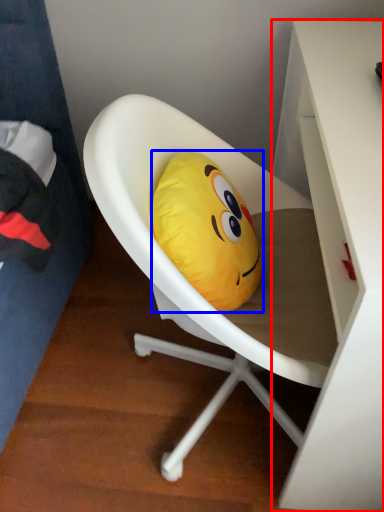
Question: Which point is closer to the camera, desk (highlighted by a red box) or pillow (highlighted by a blue box)?

Choices:
 (A) desk
 (B) pillow

Answer: (A)